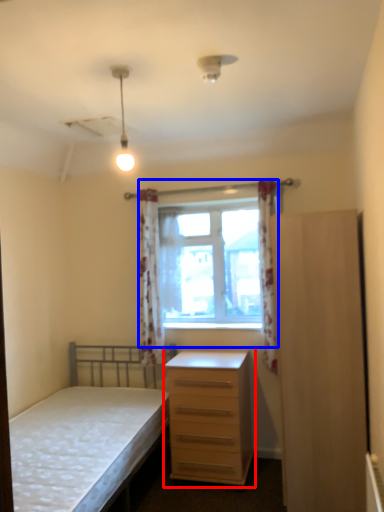
Question: Which point is further to the camera, chest of drawers (highlighted by a red box) or window (highlighted by a blue box)?

Choices:
 (A) chest of drawers
 (B) window

Answer: (B)